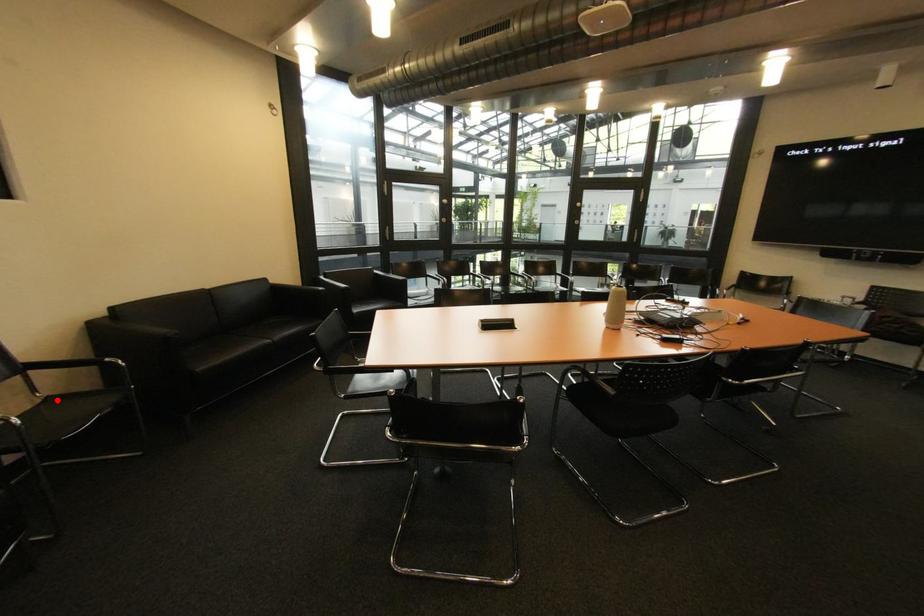
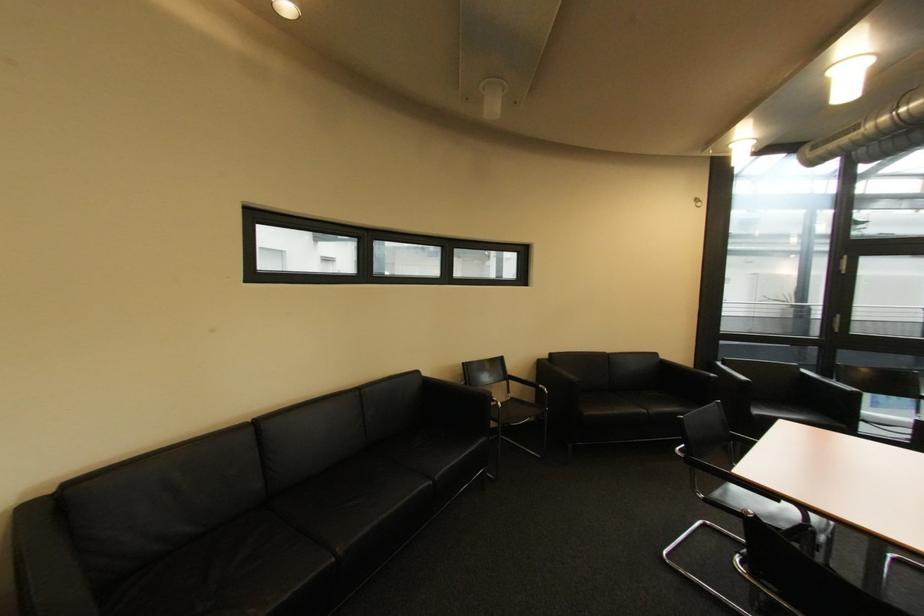
Question: I am providing you with two images of the same scene from different viewpoints. Given a red point in image1, look at the same physical point in image2. Is it:

Choices:
 (A) Closer to the viewpoint
 (B) Farther from the viewpoint

Answer: (A)